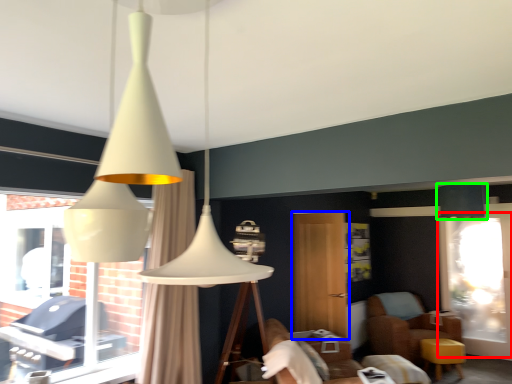
Question: Which object is the farthest from screen door (highlighted by a red box)? Choose among these: screen door (highlighted by a blue box) or lamp (highlighted by a green box).

Choices:
 (A) screen door
 (B) lamp

Answer: (A)